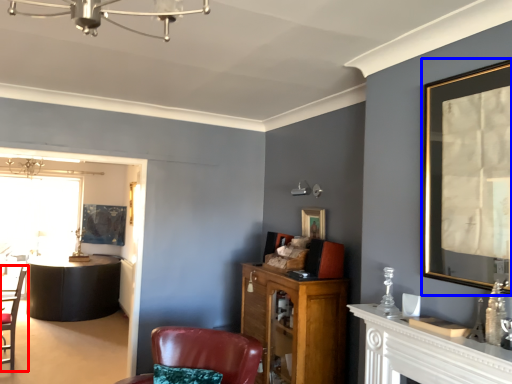
Question: Which object is closer to the camera taking this photo, chair (highlighted by a red box) or picture frame (highlighted by a blue box)?

Choices:
 (A) chair
 (B) picture frame

Answer: (B)